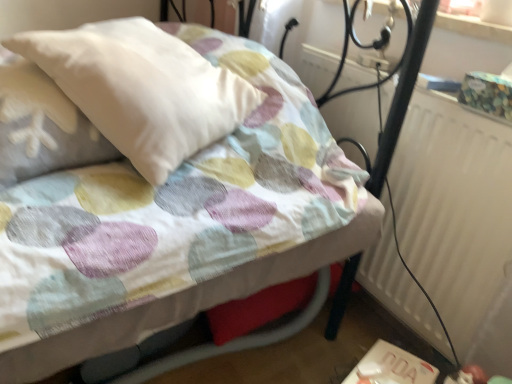
Question: Can you confirm if white plastic table at lower right is positioned to the left of white soft pillow at upper left?

Choices:
 (A) yes
 (B) no

Answer: (B)

Question: Can white soft pillow at upper left be found inside white plastic table at lower right?

Choices:
 (A) yes
 (B) no

Answer: (B)

Question: Is white plastic table at lower right further to the viewer compared to white soft pillow at upper left?

Choices:
 (A) yes
 (B) no

Answer: (A)

Question: Considering the relative sizes of white plastic table at lower right and white soft pillow at upper left in the image provided, is white plastic table at lower right bigger than white soft pillow at upper left?

Choices:
 (A) no
 (B) yes

Answer: (A)

Question: Does white plastic table at lower right appear on the right side of white soft pillow at upper left?

Choices:
 (A) yes
 (B) no

Answer: (A)

Question: From the image's perspective, is white plastic table at lower right on top of white soft pillow at upper left?

Choices:
 (A) no
 (B) yes

Answer: (A)

Question: From the image's perspective, is white plastic table at lower right located beneath white textured radiator at right?

Choices:
 (A) yes
 (B) no

Answer: (A)

Question: Is white plastic table at lower right positioned in front of white textured radiator at right?

Choices:
 (A) no
 (B) yes

Answer: (A)

Question: From a real-world perspective, is white plastic table at lower right located beneath white textured radiator at right?

Choices:
 (A) yes
 (B) no

Answer: (A)

Question: Is there a large distance between white plastic table at lower right and white textured radiator at right?

Choices:
 (A) no
 (B) yes

Answer: (A)

Question: Considering the relative sizes of white plastic table at lower right and white textured radiator at right in the image provided, is white plastic table at lower right bigger than white textured radiator at right?

Choices:
 (A) no
 (B) yes

Answer: (A)

Question: Does white plastic table at lower right have a greater height compared to white textured radiator at right?

Choices:
 (A) no
 (B) yes

Answer: (A)

Question: Is white textured radiator at right located outside white soft pillow at upper left?

Choices:
 (A) yes
 (B) no

Answer: (A)